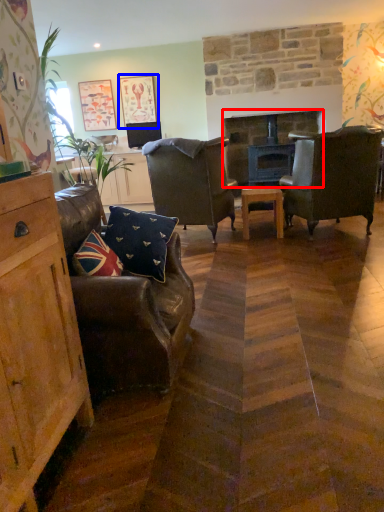
Question: Which of the following is the farthest to the observer, fireplace (highlighted by a red box) or picture frame (highlighted by a blue box)?

Choices:
 (A) fireplace
 (B) picture frame

Answer: (B)